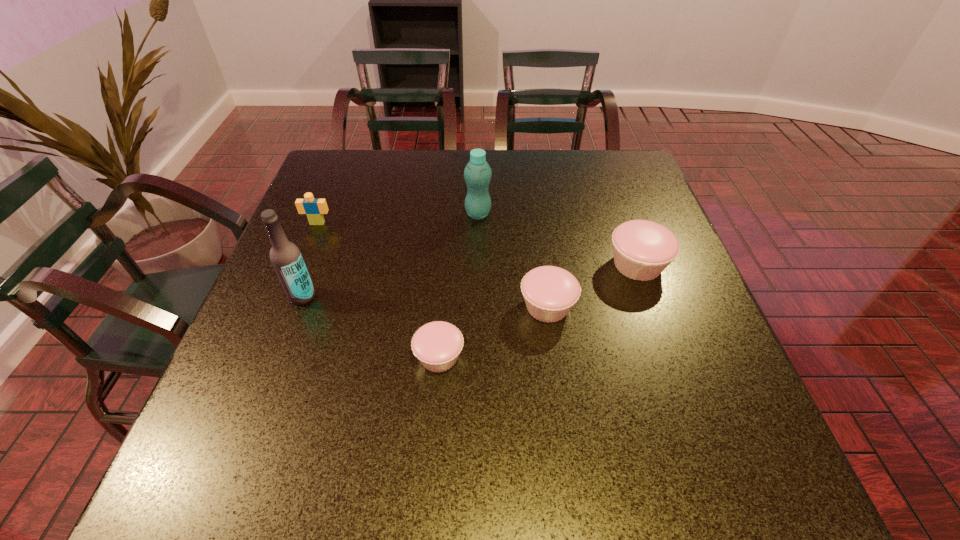
Please point a free position for a cupcake on the left. Please provide its 2D coordinates. Your answer should be formatted as a tuple, i.e. [(x, y)], where the tuple contains the x and y coordinates of a point satisfying the conditions above.

[(305, 418)]